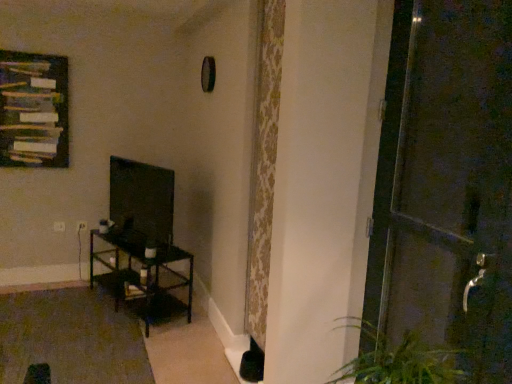
Locate an element on the screen. dark brown metal table at left is located at coordinates (144, 269).

Locate an element on the screen. This screenshot has width=512, height=384. metallic dark brown door at right is located at coordinates (446, 184).

The height and width of the screenshot is (384, 512). What do you see at coordinates (142, 198) in the screenshot?
I see `matte black tv at left` at bounding box center [142, 198].

This screenshot has height=384, width=512. I want to click on wooden frame at upper left, so click(34, 110).

Do you think matte black tv at left is within dark brown metal table at left, or outside of it?

matte black tv at left cannot be found inside dark brown metal table at left.

Is matte black tv at left positioned far away from dark brown metal table at left?

No.

Does matte black tv at left turn towards dark brown metal table at left?

No, matte black tv at left is not turned towards dark brown metal table at left.

Which of these two, matte black tv at left or dark brown metal table at left, is bigger?

Bigger between the two is dark brown metal table at left.

You are a GUI agent. You are given a task and a screenshot of the screen. Output one action in this format:
    pyautogui.click(x=<x>, y=<y>)
    Task: Click on the table lying behind the metallic dark brown door at right
    
    Given the screenshot: What is the action you would take?
    pyautogui.click(x=144, y=269)

Who is shorter, metallic dark brown door at right or dark brown metal table at left?

Standing shorter between the two is dark brown metal table at left.

Which point is more forward, (425, 205) or (128, 241)?

Point (425, 205)

Can you see wooden frame at upper left touching metallic dark brown door at right?

No, wooden frame at upper left is not with metallic dark brown door at right.

Based on the photo, from the image's perspective, which object appears higher, wooden frame at upper left or metallic dark brown door at right?

wooden frame at upper left is shown above in the image.

Is wooden frame at upper left looking in the opposite direction of metallic dark brown door at right?

wooden frame at upper left is not turned away from metallic dark brown door at right.

Is wooden frame at upper left closer to the viewer compared to metallic dark brown door at right?

No, wooden frame at upper left is behind metallic dark brown door at right.

Considering the sizes of objects metallic dark brown door at right and wooden frame at upper left in the image provided, who is wider, metallic dark brown door at right or wooden frame at upper left?

metallic dark brown door at right.

Does metallic dark brown door at right lie in front of wooden frame at upper left?

Yes, metallic dark brown door at right is closer to the viewer.

Is metallic dark brown door at right spatially inside wooden frame at upper left, or outside of it?

metallic dark brown door at right is not inside wooden frame at upper left, it's outside.

Is matte black tv at left bigger or smaller than wooden frame at upper left?

Clearly, matte black tv at left is larger in size than wooden frame at upper left.

Which is more to the left, matte black tv at left or wooden frame at upper left?

wooden frame at upper left is more to the left.

Who is taller, matte black tv at left or wooden frame at upper left?

Standing taller between the two is wooden frame at upper left.

Is matte black tv at left spatially inside wooden frame at upper left, or outside of it?

matte black tv at left lies outside wooden frame at upper left.

Considering the relative positions of wooden frame at upper left and matte black tv at left in the image provided, is wooden frame at upper left to the left of matte black tv at left from the viewer's perspective?

Yes.

Does wooden frame at upper left lie in front of matte black tv at left?

No, the depth of wooden frame at upper left is greater than that of matte black tv at left.

Does wooden frame at upper left have a smaller size compared to matte black tv at left?

Yes.

Can metallic dark brown door at right be found inside matte black tv at left?

No, metallic dark brown door at right is not inside matte black tv at left.

Could you tell me if matte black tv at left is turned towards metallic dark brown door at right?

No, matte black tv at left is not oriented towards metallic dark brown door at right.

From a real-world perspective, which is physically above, matte black tv at left or metallic dark brown door at right?

In real-world perspective, metallic dark brown door at right is above.

Where is `wide behind the metallic dark brown door at right`? This screenshot has width=512, height=384. wide behind the metallic dark brown door at right is located at coordinates (142, 198).

Identify the location of wide on the right of dark brown metal table at left. (142, 198).

Locate an element on the screen. The height and width of the screenshot is (384, 512). door that appears in front of the dark brown metal table at left is located at coordinates point(446,184).

Estimate the real-world distances between objects in this image. Which object is closer to dark brown metal table at left, metallic dark brown door at right or matte black tv at left?

matte black tv at left is closer to dark brown metal table at left.

Looking at the image, which one is located closer to dark brown metal table at left, wooden frame at upper left or metallic dark brown door at right?

Based on the image, wooden frame at upper left appears to be nearer to dark brown metal table at left.

When comparing their distances from matte black tv at left, does dark brown metal table at left or wooden frame at upper left seem closer?

dark brown metal table at left is positioned closer to the anchor matte black tv at left.

Considering their positions, is wooden frame at upper left positioned closer to metallic dark brown door at right than dark brown metal table at left?

dark brown metal table at left lies closer to metallic dark brown door at right than the other object.

Looking at the image, which one is located further to matte black tv at left, dark brown metal table at left or metallic dark brown door at right?

metallic dark brown door at right.

From the image, which object appears to be nearer to wooden frame at upper left, matte black tv at left or dark brown metal table at left?

matte black tv at left.

Looking at the image, which one is located further to metallic dark brown door at right, dark brown metal table at left or wooden frame at upper left?

wooden frame at upper left.

Looking at the image, which one is located closer to wooden frame at upper left, matte black tv at left or metallic dark brown door at right?

Based on the image, matte black tv at left appears to be nearer to wooden frame at upper left.

Where is `wide between dark brown metal table at left and metallic dark brown door at right from left to right`? The height and width of the screenshot is (384, 512). wide between dark brown metal table at left and metallic dark brown door at right from left to right is located at coordinates click(x=142, y=198).

In order to click on wide between wooden frame at upper left and dark brown metal table at left from top to bottom in this screenshot , I will do `click(142, 198)`.

Where is `table between wooden frame at upper left and metallic dark brown door at right`? The image size is (512, 384). table between wooden frame at upper left and metallic dark brown door at right is located at coordinates (144, 269).

Locate an element on the screen. wide situated between wooden frame at upper left and metallic dark brown door at right from left to right is located at coordinates (142, 198).